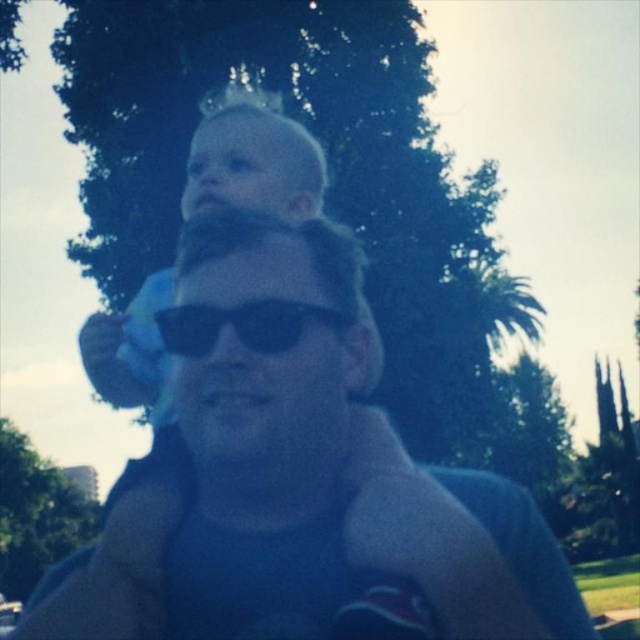
Question: Is blonde hair baby at upper center smaller than black plastic sunglasses at center?

Choices:
 (A) yes
 (B) no

Answer: (B)

Question: Which point is closer to the camera taking this photo?

Choices:
 (A) (236, 324)
 (B) (220, 106)

Answer: (A)

Question: Which object appears farthest from the camera in this image?

Choices:
 (A) blonde hair baby at upper center
 (B) black plastic sunglasses at center
 (C) blue fabric shirt at center

Answer: (A)

Question: Which of the following is the farthest from the observer?

Choices:
 (A) blue fabric shirt at center
 (B) blonde hair baby at upper center
 (C) black plastic sunglasses at center

Answer: (B)

Question: Is the position of blonde hair baby at upper center more distant than that of black plastic sunglasses at center?

Choices:
 (A) yes
 (B) no

Answer: (A)

Question: Does blue fabric shirt at center appear on the right side of blonde hair baby at upper center?

Choices:
 (A) yes
 (B) no

Answer: (A)